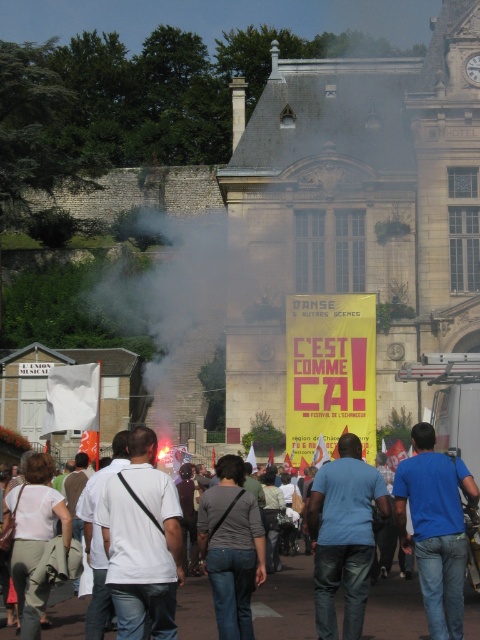
Does point (200, 417) come in front of point (453, 588)?

No.

Can you confirm if white smoke at center is bigger than blue denim jeans at lower right?

Yes.

Measure the distance between point (252,372) and camera.

87.87 meters

Identify the location of white smoke at center. (230, 332).

Measure the distance between point (219, 540) and camera.

45.48 meters

Between point (238, 465) and point (44, 486), which one is positioned in front?

Point (44, 486)

Identify the location of denim jeans at center. (230, 547).

Does point (172, 376) come in front of point (369, 531)?

No, it is not.

From the picture: Between white smoke at center and blue denim jeans at center, which one has less height?

blue denim jeans at center

Does point (216, 321) come in front of point (377, 504)?

That is False.

The image size is (480, 640). In order to click on white smoke at center in this screenshot , I will do `click(230, 332)`.